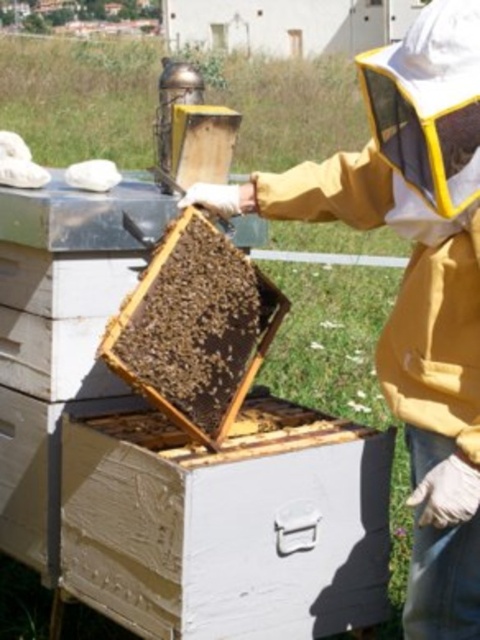
Is yellow fabric beekeeper at center smaller than beehive at center?

No.

Does yellow fabric beekeeper at center come in front of beehive at center?

Yes, yellow fabric beekeeper at center is in front of beehive at center.

Does point (460, 285) lie in front of point (204, 224)?

That is True.

Locate an element on the screen. The height and width of the screenshot is (640, 480). yellow fabric beekeeper at center is located at coordinates (416, 284).